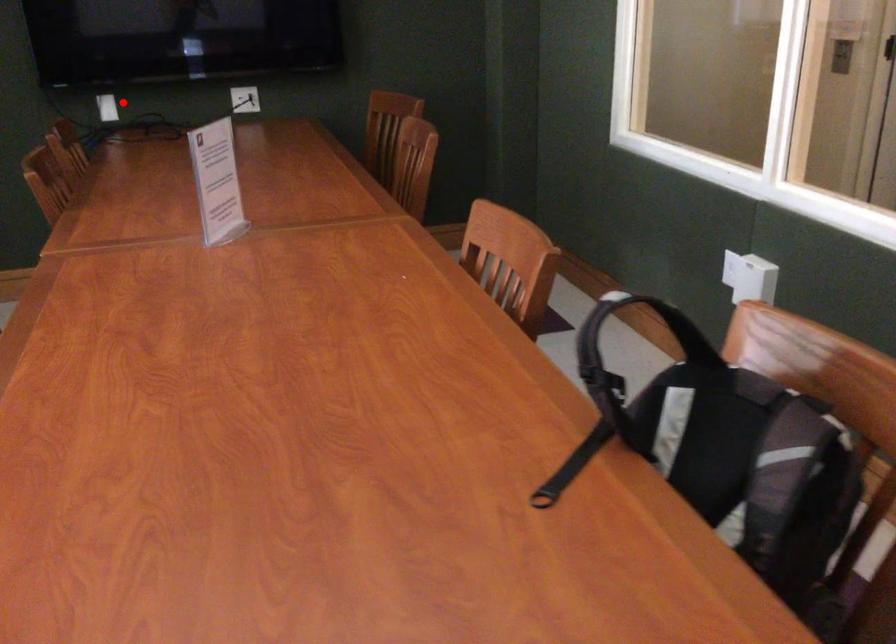
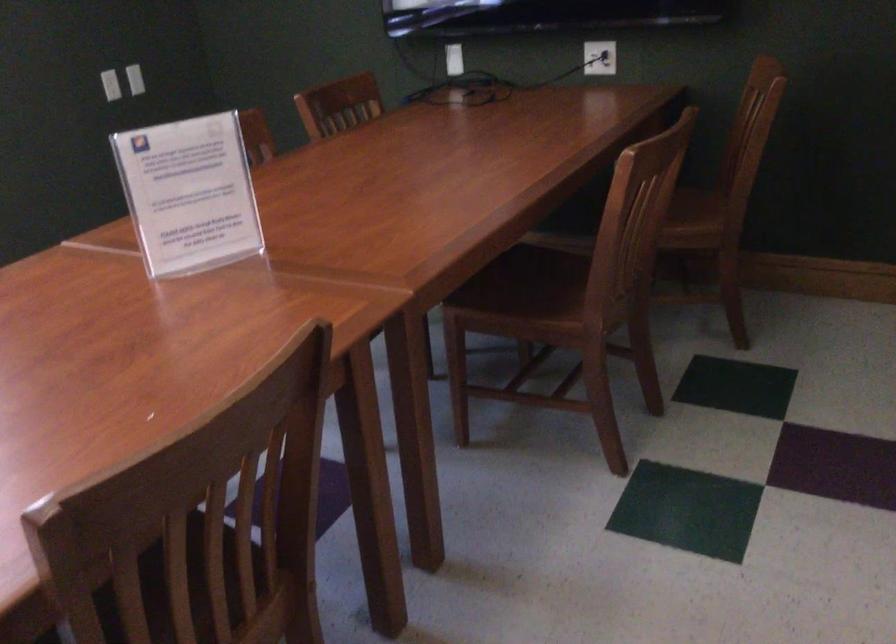
Question: A red point is marked in image1. In image2, is the corresponding 3D point closer to the camera or farther? Reply with the corresponding letter.

Choices:
 (A) The corresponding 3D point is closer.
 (B) The corresponding 3D point is farther.

Answer: (A)